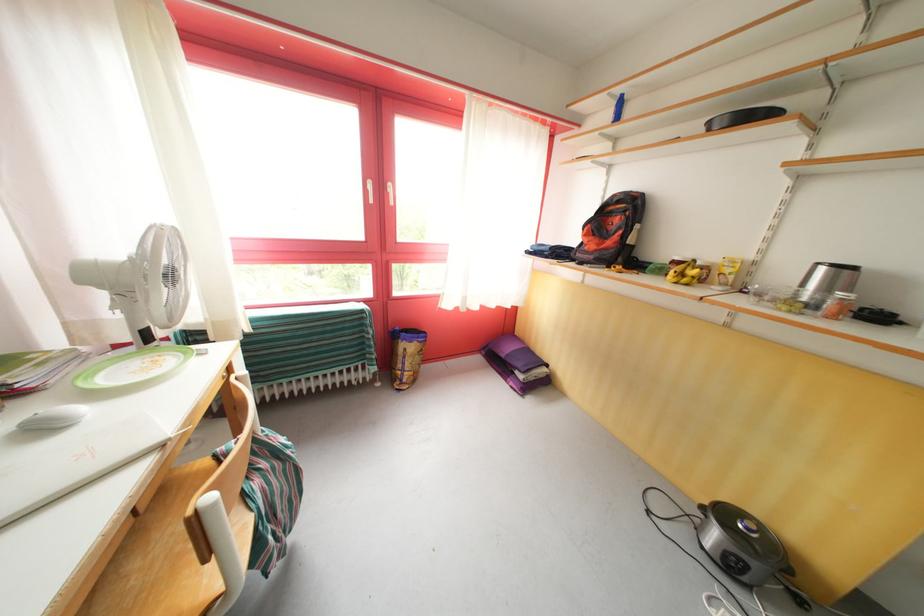
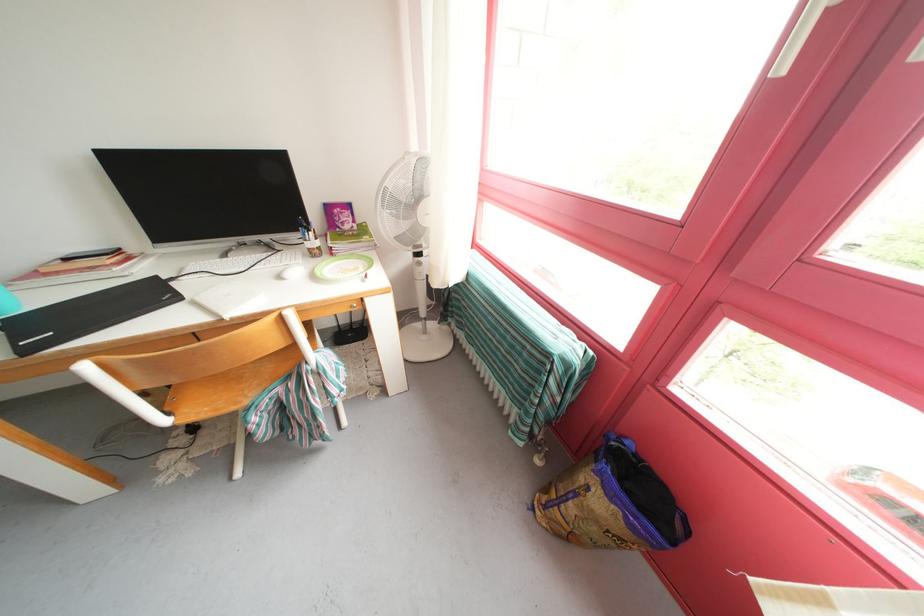
In the second image, find the point that corresponds to (411,363) in the first image.

(582, 499)